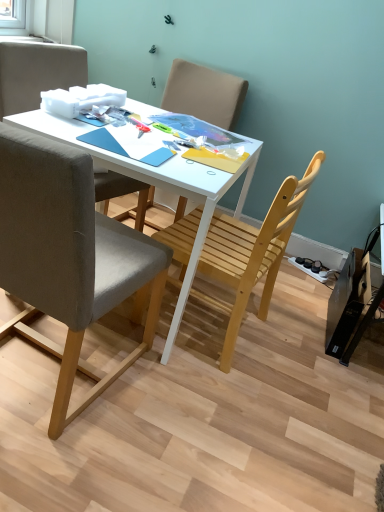
Question: Is light brown wooden chair at center, which is counted as the 1th chair, starting from the back, situated inside light wood chair at center, which is the third chair in back-to-front order, or outside?

Choices:
 (A) inside
 (B) outside

Answer: (B)

Question: Is light brown wooden chair at center, which is the 4th chair from front to back, wider or thinner than light wood chair at center, which is the third chair in back-to-front order?

Choices:
 (A) wide
 (B) thin

Answer: (A)

Question: Based on their relative distances, which object is farther from the gray fabric chair at left, acting as the 4th chair starting from the back?

Choices:
 (A) white matte desk at center
 (B) light wood chair at center, placed as the second chair when sorted from front to back
 (C) matte gray chair at upper left, marked as the third chair in a front-to-back arrangement
 (D) light brown wooden chair at center, which is counted as the 1th chair, starting from the back

Answer: (D)

Question: Estimate the real-world distances between objects in this image. Which object is farther from the matte gray chair at upper left, marked as the third chair in a front-to-back arrangement?

Choices:
 (A) gray fabric chair at left, which is counted as the first chair, starting from the front
 (B) light brown wooden chair at center, which is counted as the 1th chair, starting from the back
 (C) light wood chair at center, which is the third chair in back-to-front order
 (D) white matte desk at center

Answer: (C)